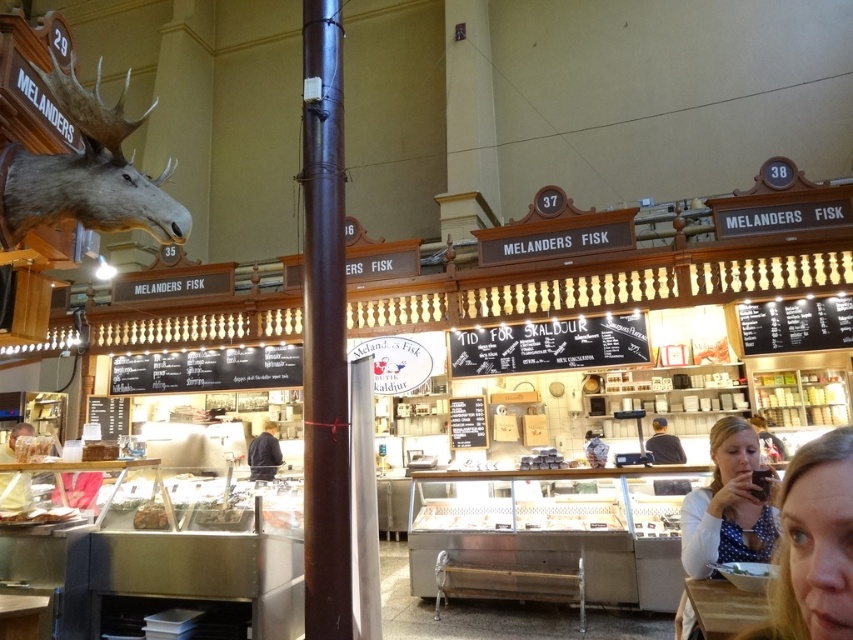
Between polka dot blouse at lower right and shiny silver tray at center, which one appears on the right side from the viewer's perspective?

From the viewer's perspective, polka dot blouse at lower right appears more on the right side.

Can you confirm if polka dot blouse at lower right is positioned to the left of shiny silver tray at center?

No, polka dot blouse at lower right is not to the left of shiny silver tray at center.

This screenshot has width=853, height=640. Find the location of `polka dot blouse at lower right`. polka dot blouse at lower right is located at coordinates (813, 545).

At what (x,y) coordinates should I click in order to perform the action: click on polka dot blouse at lower right. Please return your answer as a coordinate pair (x, y). Looking at the image, I should click on coord(813,545).

Can you confirm if dark blue shirt at center is wider than porcelain cup at center?

→ Yes.

Which is more to the left, dark blue shirt at center or porcelain cup at center?

Positioned to the left is dark blue shirt at center.

Who is more distant from viewer, (253, 468) or (590, 444)?

The point (253, 468) is more distant.

This screenshot has width=853, height=640. I want to click on dark blue shirt at center, so click(264, 452).

Which is more to the left, polka dot blouse at lower right or matte brown wooden tray at lower left?

matte brown wooden tray at lower left

Locate an element on the screen. The height and width of the screenshot is (640, 853). polka dot blouse at lower right is located at coordinates (813, 545).